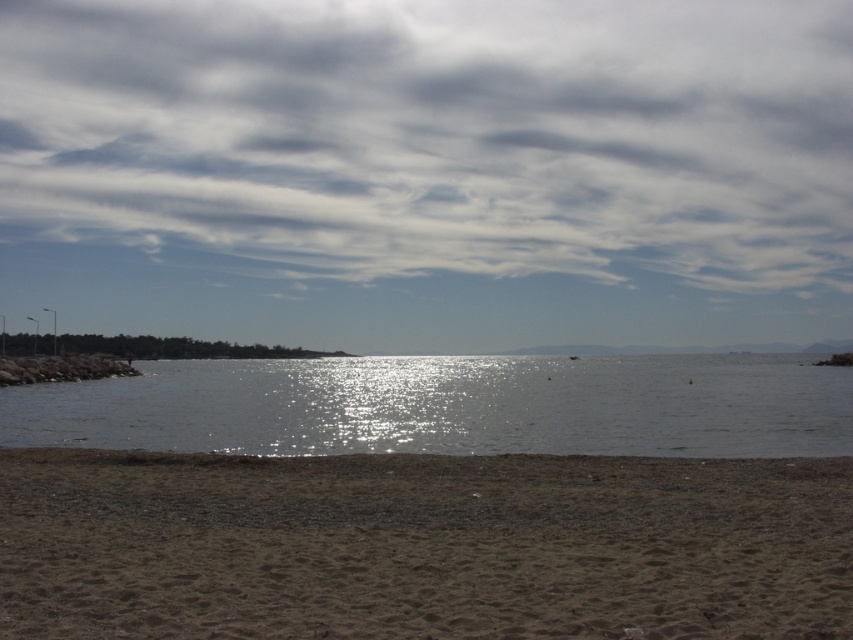
Who is more distant from viewer, (318, 182) or (178, 544)?

Point (318, 182)

Does cloudy sky at upper center appear over brown sandy beach at lower center?

Yes, cloudy sky at upper center is above brown sandy beach at lower center.

The image size is (853, 640). I want to click on cloudy sky at upper center, so click(x=439, y=136).

I want to click on cloudy sky at upper center, so click(439, 136).

Who is lower down, brown sandy beach at lower center or glistening water at center?

Positioned lower is glistening water at center.

Can you confirm if brown sandy beach at lower center is bigger than glistening water at center?

No.

In order to click on brown sandy beach at lower center in this screenshot , I will do `click(421, 545)`.

Does cloudy sky at upper center appear under glistening water at center?

Actually, cloudy sky at upper center is above glistening water at center.

Is cloudy sky at upper center bigger than glistening water at center?

Correct, cloudy sky at upper center is larger in size than glistening water at center.

Describe the element at coordinates (439, 136) in the screenshot. I see `cloudy sky at upper center` at that location.

You are a GUI agent. You are given a task and a screenshot of the screen. Output one action in this format:
    pyautogui.click(x=<x>, y=<y>)
    Task: Click on the cloudy sky at upper center
    This screenshot has width=853, height=640.
    Given the screenshot: What is the action you would take?
    pyautogui.click(x=439, y=136)